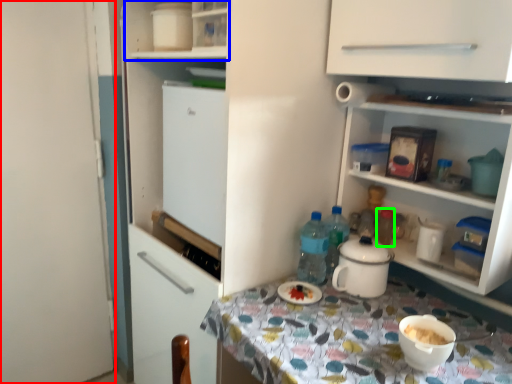
Question: Based on their relative distances, which object is nearer to door (highlighted by a red box)? Choose from cabinet (highlighted by a blue box) and bottle (highlighted by a green box).

Choices:
 (A) cabinet
 (B) bottle

Answer: (A)